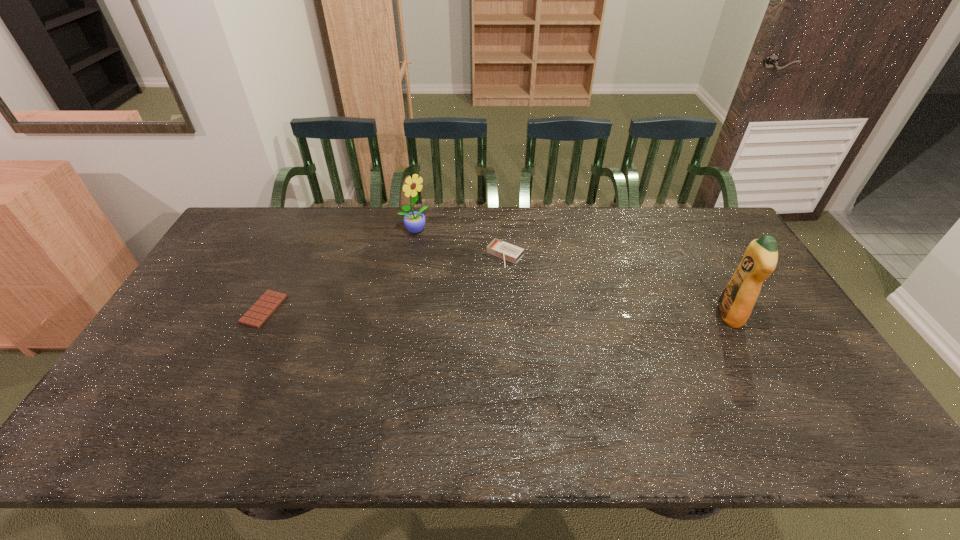
Find the location of a particular element. The width and height of the screenshot is (960, 540). object that is at the right edge is located at coordinates (737, 300).

At what (x,y) coordinates should I click in order to perform the action: click on free spot at the far edge of the desktop. Please return your answer as a coordinate pair (x, y). This screenshot has height=540, width=960. Looking at the image, I should click on (515, 211).

At what (x,y) coordinates should I click in order to perform the action: click on vacant space at the near edge. Please return your answer as a coordinate pair (x, y). This screenshot has height=540, width=960. Looking at the image, I should click on (651, 390).

In the image, there is a desktop. Where is `vacant space at the near left corner`? Image resolution: width=960 pixels, height=540 pixels. vacant space at the near left corner is located at coordinates (171, 404).

I want to click on vacant space at the far right corner of the desktop, so click(x=723, y=224).

Where is `free space between the rightmost object and the matchbox`? This screenshot has width=960, height=540. free space between the rightmost object and the matchbox is located at coordinates (617, 285).

At what (x,y) coordinates should I click in order to perform the action: click on vacant space that's between the second object from left to right and the leftmost object. Please return your answer as a coordinate pair (x, y). Image resolution: width=960 pixels, height=540 pixels. Looking at the image, I should click on (339, 269).

At what (x,y) coordinates should I click in order to perform the action: click on free space between the third object from right to left and the tallest object. Please return your answer as a coordinate pair (x, y). This screenshot has width=960, height=540. Looking at the image, I should click on (572, 273).

What are the coordinates of `unoccupied area between the third shortest object and the second shortest object` in the screenshot? It's located at [x=460, y=243].

Find the location of `free space between the sunflower and the candy bar`. free space between the sunflower and the candy bar is located at coordinates (339, 269).